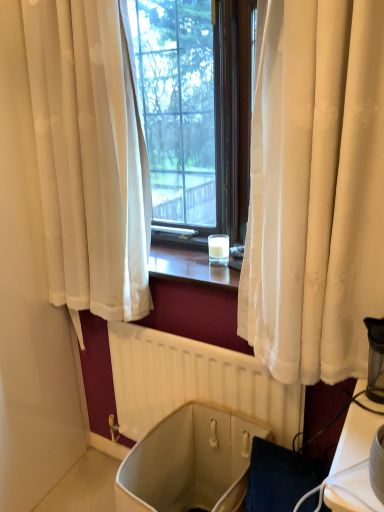
Question: Should I look upward or downward to see beige fabric bath at lower center?

Choices:
 (A) up
 (B) down

Answer: (B)

Question: Can you confirm if white matte radiator at center is positioned to the right of beige fabric bath at lower center?

Choices:
 (A) no
 (B) yes

Answer: (B)

Question: From a real-world perspective, is white matte radiator at center beneath beige fabric bath at lower center?

Choices:
 (A) no
 (B) yes

Answer: (A)

Question: From the image's perspective, is white matte radiator at center below beige fabric bath at lower center?

Choices:
 (A) yes
 (B) no

Answer: (B)

Question: Can you confirm if white matte radiator at center is bigger than beige fabric bath at lower center?

Choices:
 (A) no
 (B) yes

Answer: (A)

Question: Considering the relative positions of white matte radiator at center and beige fabric bath at lower center in the image provided, is white matte radiator at center to the left of beige fabric bath at lower center from the viewer's perspective?

Choices:
 (A) no
 (B) yes

Answer: (A)

Question: Are white matte radiator at center and beige fabric bath at lower center located far from each other?

Choices:
 (A) no
 (B) yes

Answer: (A)

Question: Does beige fabric bath at lower center have a greater height compared to white matte radiator at center?

Choices:
 (A) yes
 (B) no

Answer: (B)

Question: Considering the relative sizes of beige fabric bath at lower center and white matte radiator at center in the image provided, is beige fabric bath at lower center shorter than white matte radiator at center?

Choices:
 (A) yes
 (B) no

Answer: (A)

Question: Is beige fabric bath at lower center to the left of white matte radiator at center from the viewer's perspective?

Choices:
 (A) yes
 (B) no

Answer: (A)

Question: Are beige fabric bath at lower center and white matte radiator at center located far from each other?

Choices:
 (A) yes
 (B) no

Answer: (B)

Question: Can you confirm if beige fabric bath at lower center is thinner than white matte radiator at center?

Choices:
 (A) no
 (B) yes

Answer: (A)

Question: Is beige fabric bath at lower center directly adjacent to white matte radiator at center?

Choices:
 (A) yes
 (B) no

Answer: (B)

Question: In the image, is beige fabric bath at lower center positioned in front of or behind white matte radiator at center?

Choices:
 (A) front
 (B) behind

Answer: (A)